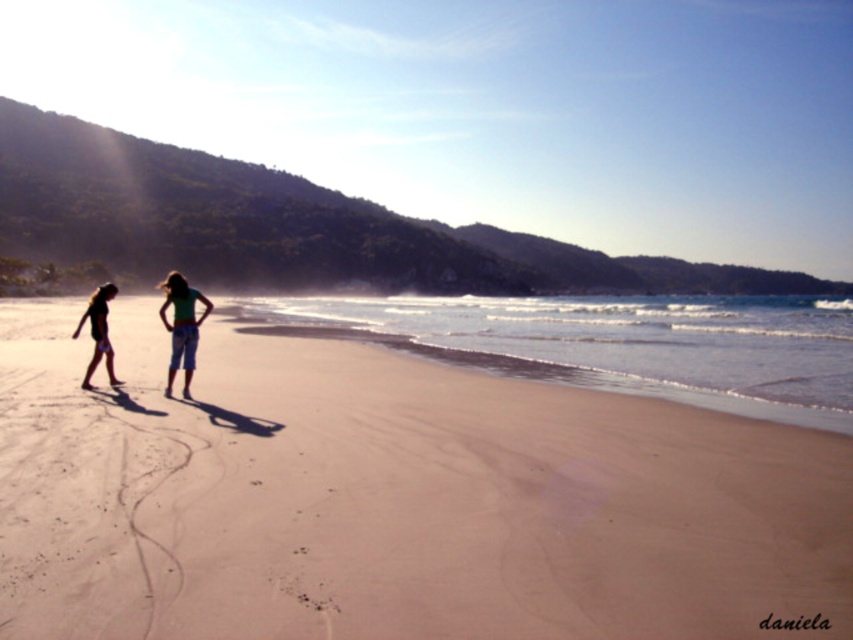
Question: Can you confirm if sandy shore at lower center is smaller than green fabric shorts at center?

Choices:
 (A) yes
 (B) no

Answer: (B)

Question: Is sandy beach at center further to camera compared to sandy shore at lower center?

Choices:
 (A) no
 (B) yes

Answer: (A)

Question: Which point is farther from the camera taking this photo?

Choices:
 (A) (572, 317)
 (B) (204, 312)
 (C) (181, 317)

Answer: (A)

Question: Based on their relative distances, which object is nearer to the sandy shore at lower center?

Choices:
 (A) green cotton shorts at center
 (B) green fabric shorts at center
 (C) sandy beach at center
 (D) matte black shorts at left

Answer: (C)

Question: Which object is farther from the camera taking this photo?

Choices:
 (A) sandy shore at lower center
 (B) sandy beach at center
 (C) green cotton shorts at center
 (D) green fabric shorts at center

Answer: (C)

Question: Can you confirm if sandy shore at lower center is positioned to the left of green fabric shorts at center?

Choices:
 (A) no
 (B) yes

Answer: (A)